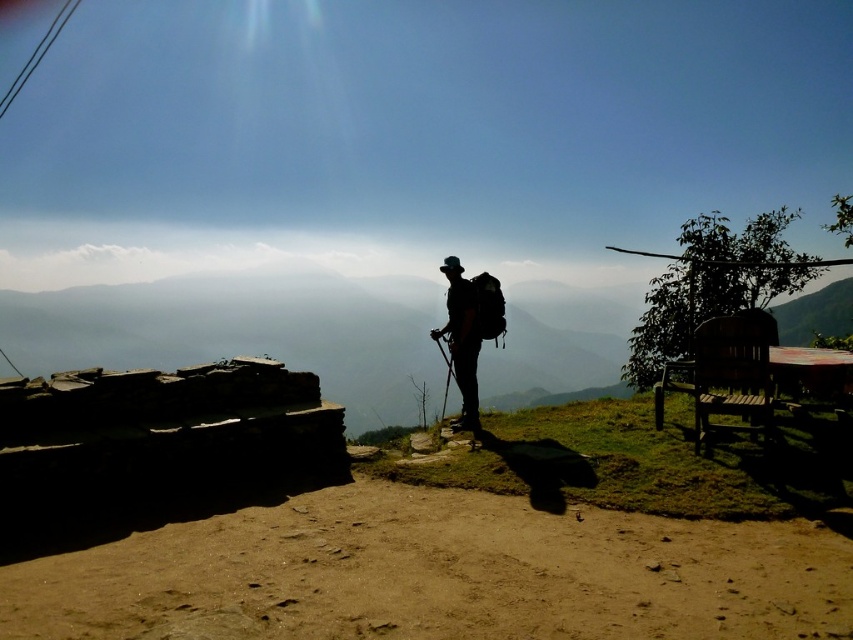
Is silhouette backpack at center wider than smooth black ski pole at center?

Yes, silhouette backpack at center is wider than smooth black ski pole at center.

Can you confirm if silhouette backpack at center is shorter than smooth black ski pole at center?

No.

Where is `silhouette backpack at center`? This screenshot has width=853, height=640. silhouette backpack at center is located at coordinates (462, 339).